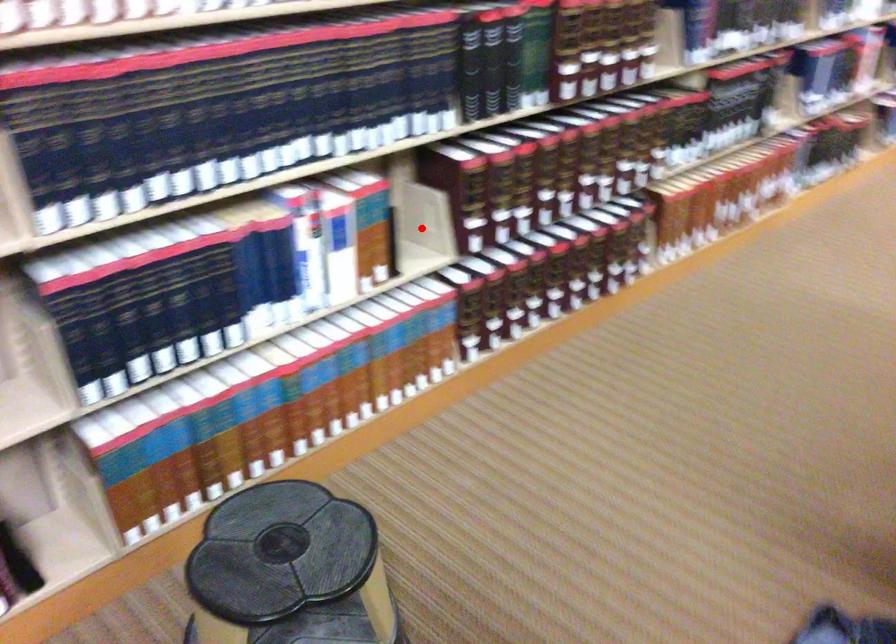
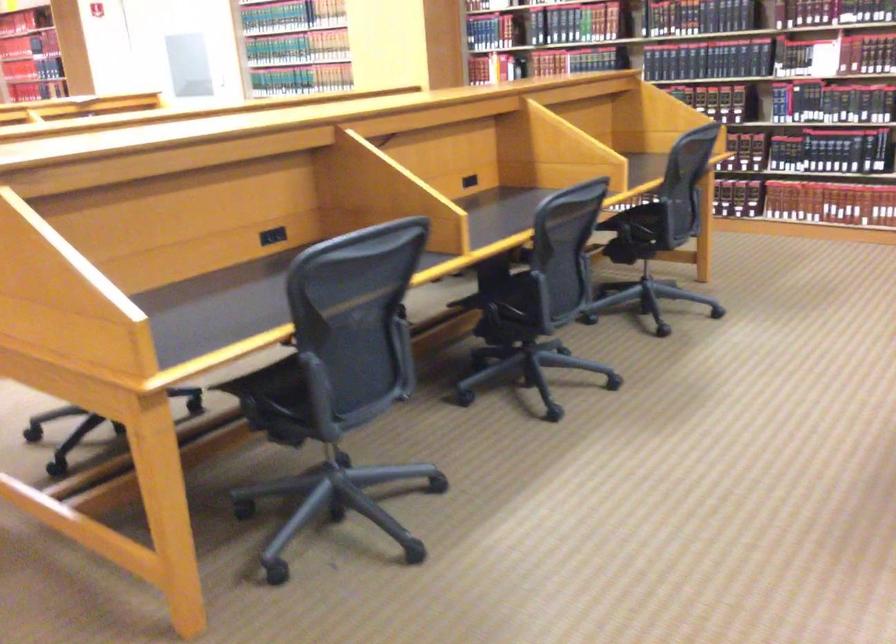
Question: I am providing you with two images of the same scene from different viewpoints. A red point is marked on the first image. At the location where the point appears in image 1, is it still visible in image 2?

Choices:
 (A) Yes
 (B) No

Answer: (B)